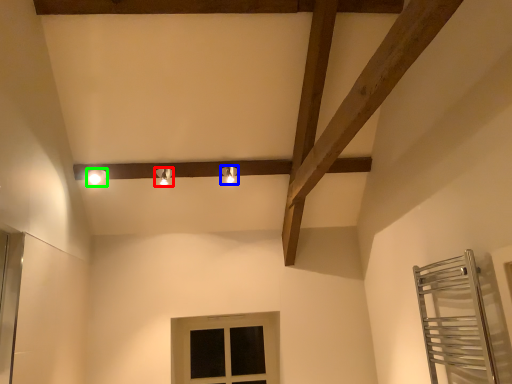
Question: Which object is the closest to the light fixture (highlighted by a red box)? Choose among these: light fixture (highlighted by a blue box) or light fixture (highlighted by a green box).

Choices:
 (A) light fixture
 (B) light fixture

Answer: (B)